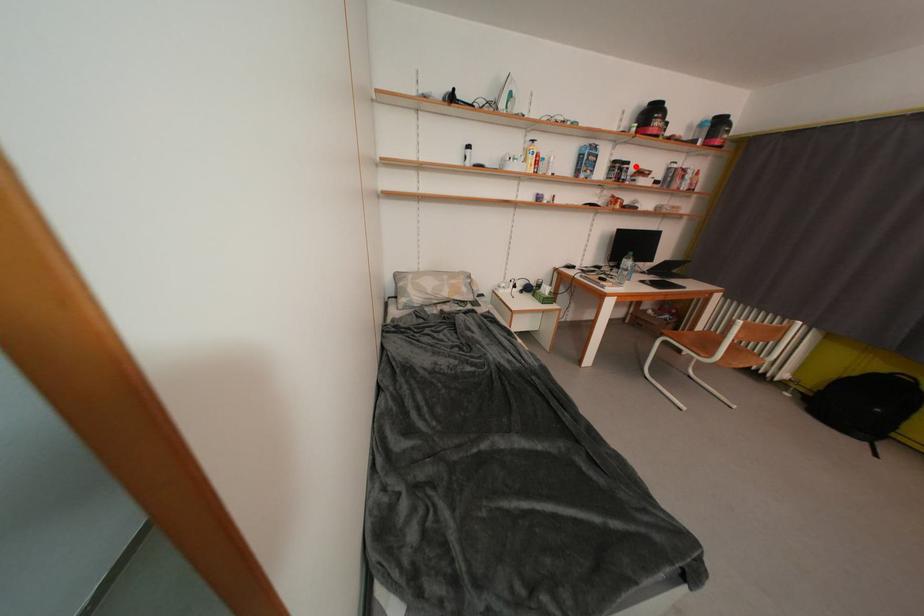
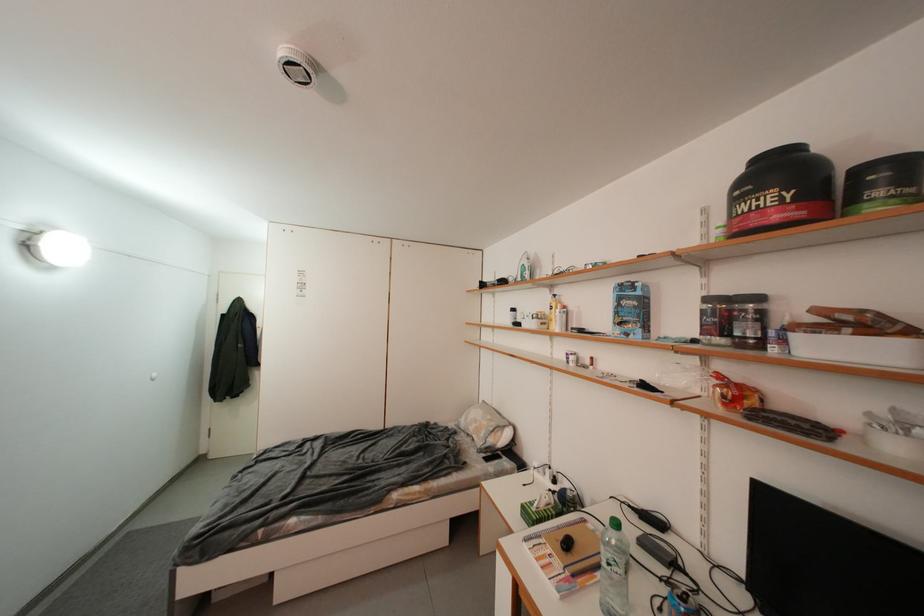
Question: I am providing you with two images of the same scene from different viewpoints. A red point is shown in image1. For the corresponding object point in image2, is it positioned nearer or farther from the camera?

Choices:
 (A) Nearer
 (B) Farther

Answer: (B)